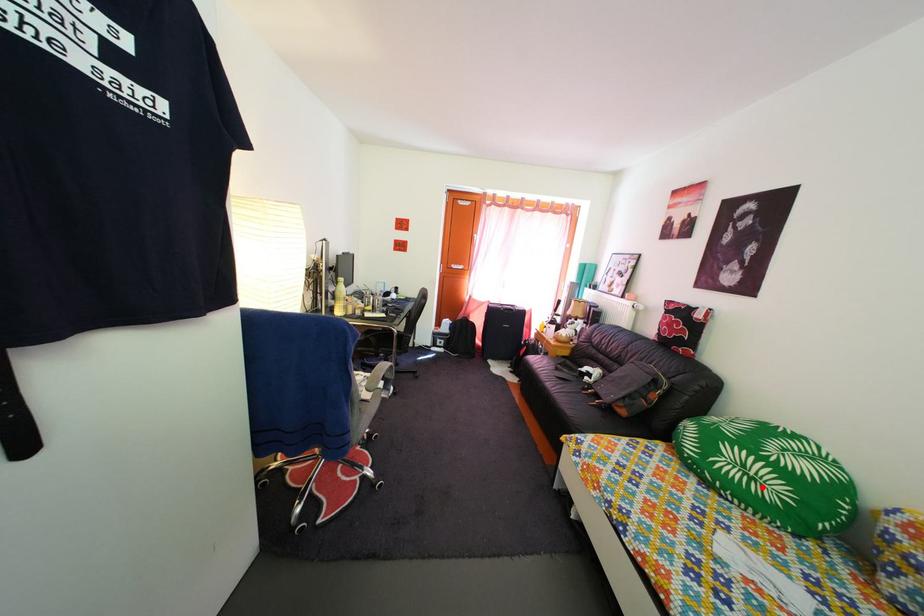
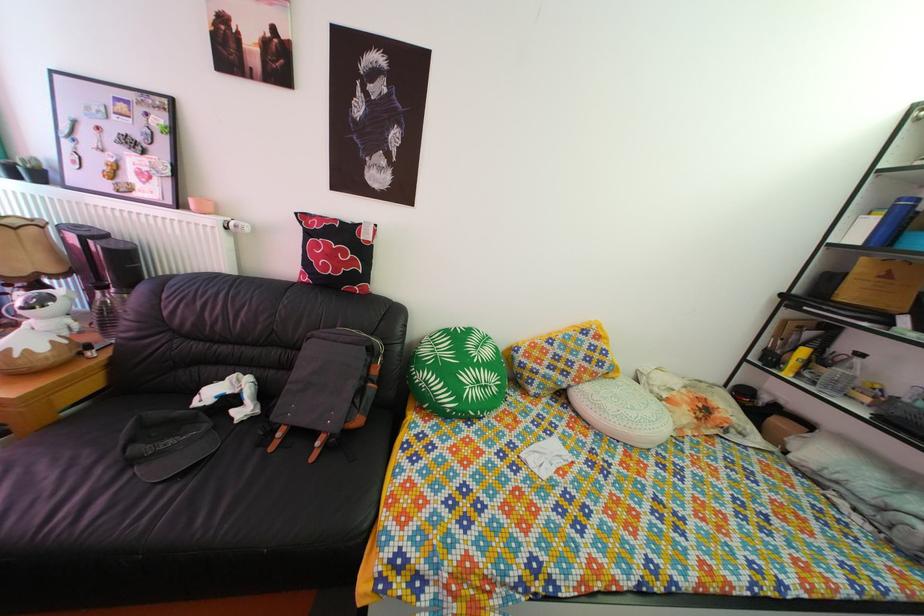
Where in the second image is the point corresponding to the highlighted location from the first image?

(494, 395)